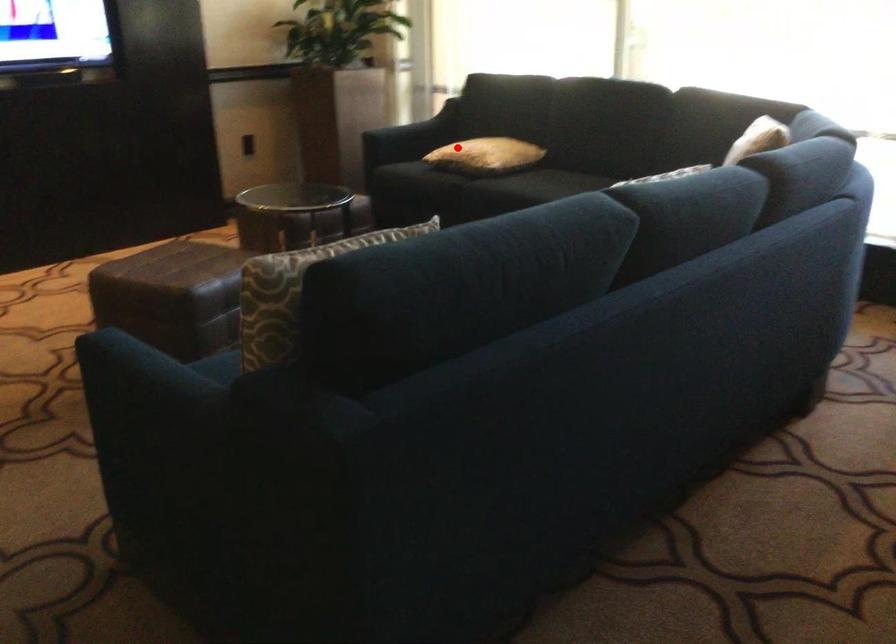
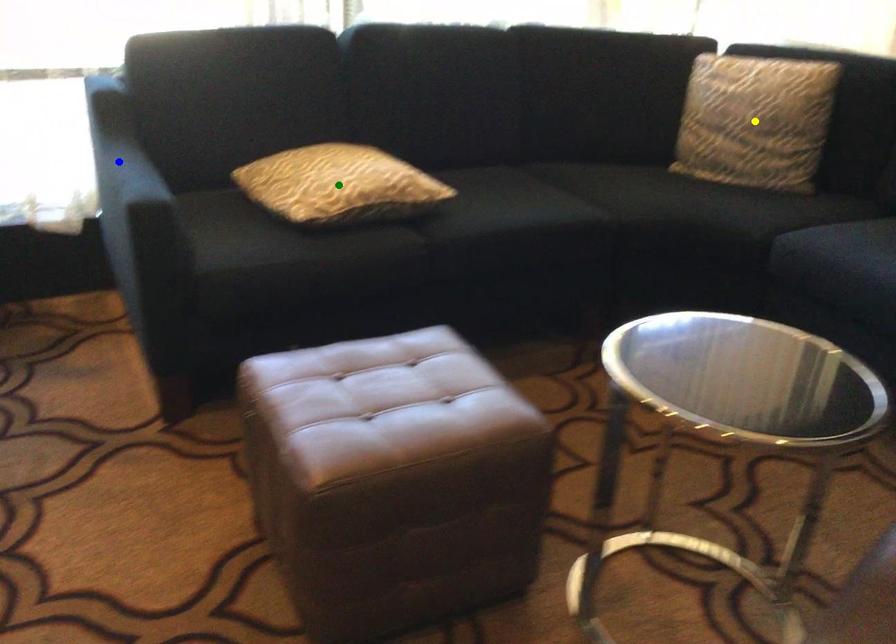
Question: I am providing you with two images of the same scene from different viewpoints. A red point is marked on the first image. You are given multiple points on the second image. Which point in image 2 represents the same 3d spot as the red point in image 1?

Choices:
 (A) blue point
 (B) green point
 (C) yellow point

Answer: (B)